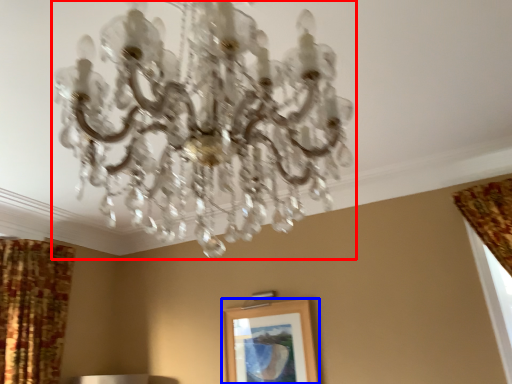
Question: Which object appears farthest to the camera in this image, lamp (highlighted by a red box) or picture frame (highlighted by a blue box)?

Choices:
 (A) lamp
 (B) picture frame

Answer: (B)